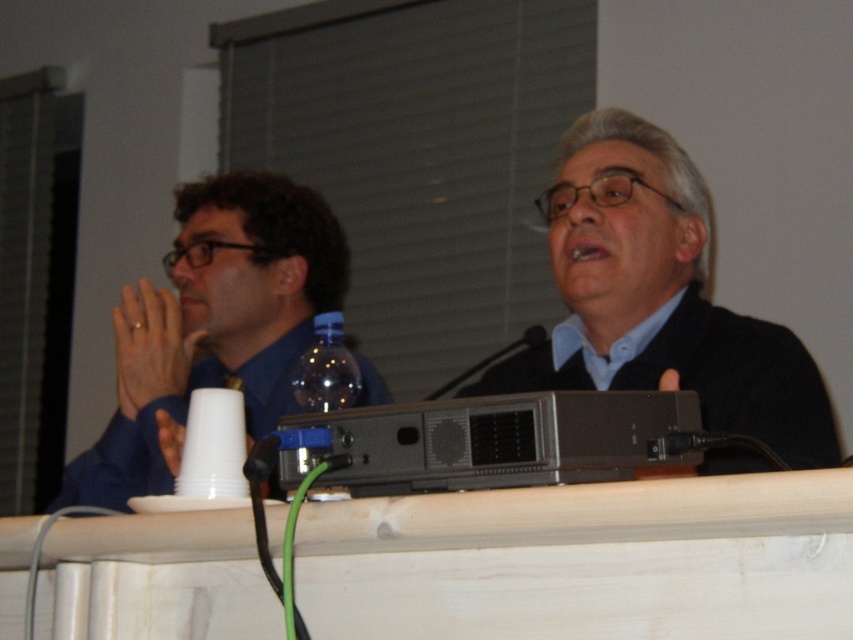
Question: Is gold ring at left bigger than black plastic microphone at center?

Choices:
 (A) no
 (B) yes

Answer: (A)

Question: Which of these objects is positioned farthest from the black plastic microphone at center?

Choices:
 (A) black matte suit at center
 (B) white plastic cup at lower left
 (C) translucent plastic bottle at center
 (D) gold ring at left

Answer: (D)

Question: Does blue shirt at left appear on the left side of black plastic microphone at center?

Choices:
 (A) no
 (B) yes

Answer: (B)

Question: Which of the following is the farthest from the observer?

Choices:
 (A) blue shirt at left
 (B) gold ring at left
 (C) black plastic microphone at center

Answer: (B)

Question: Is black matte suit at center to the right of gold ring at left from the viewer's perspective?

Choices:
 (A) yes
 (B) no

Answer: (A)

Question: Estimate the real-world distances between objects in this image. Which object is farther from the translucent plastic bottle at center?

Choices:
 (A) white plastic cup at lower left
 (B) black plastic microphone at center
 (C) gold ring at left
 (D) blue shirt at left

Answer: (D)